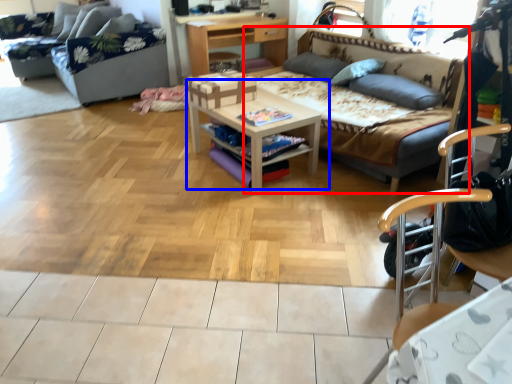
Question: Which object appears farthest to the camera in this image, studio couch (highlighted by a red box) or table (highlighted by a blue box)?

Choices:
 (A) studio couch
 (B) table

Answer: (B)